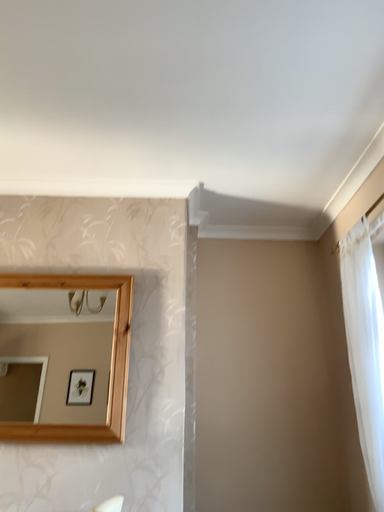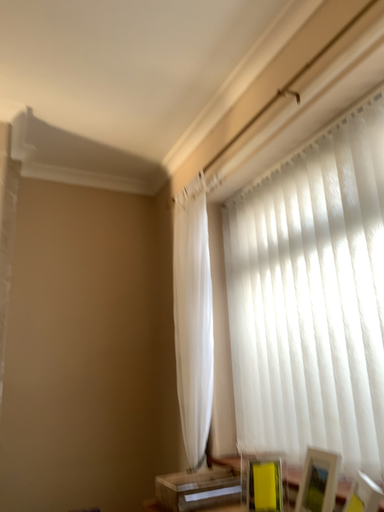
Question: Which way did the camera rotate in the video?

Choices:
 (A) rotated left
 (B) rotated right

Answer: (B)